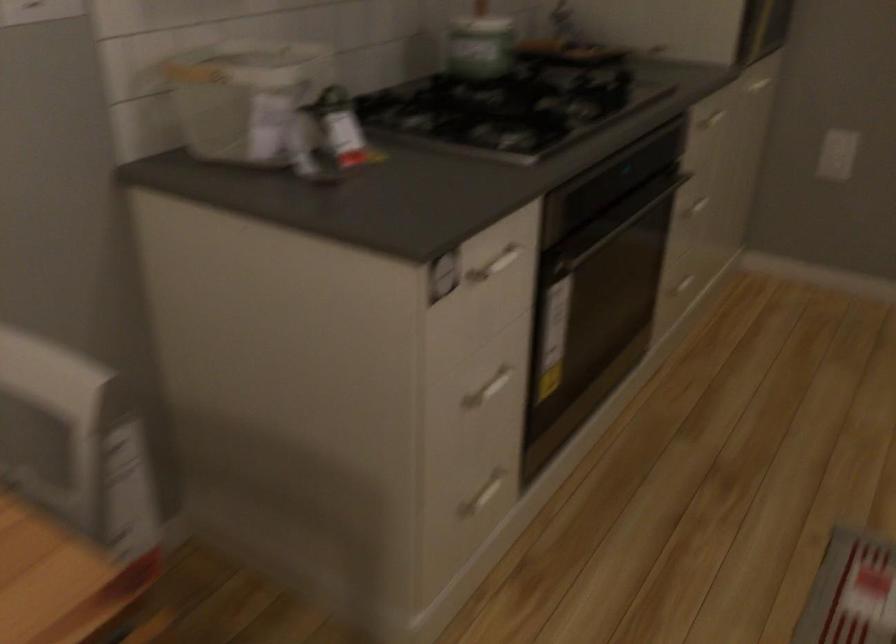
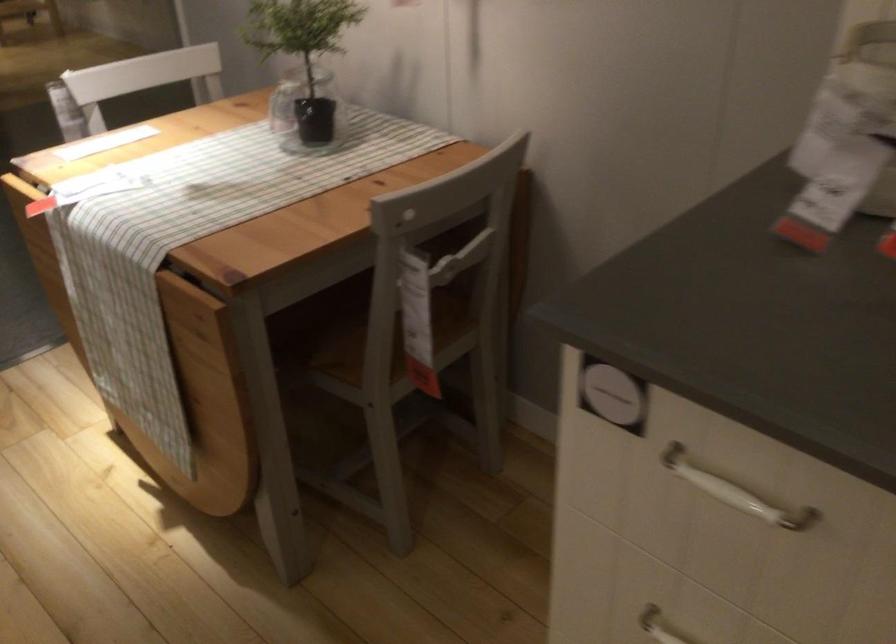
Find the pixel in the second image that matches point (452, 428) in the first image.

(659, 626)